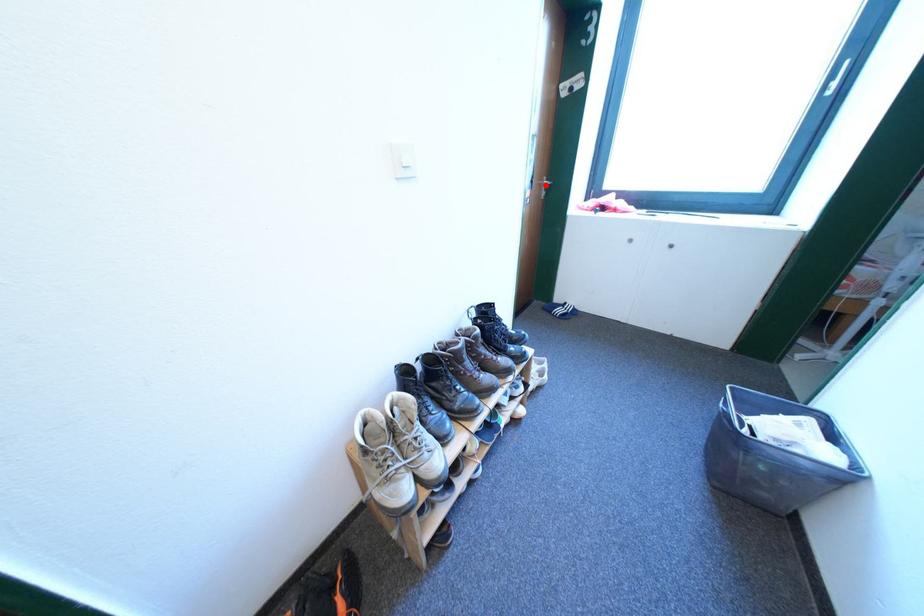
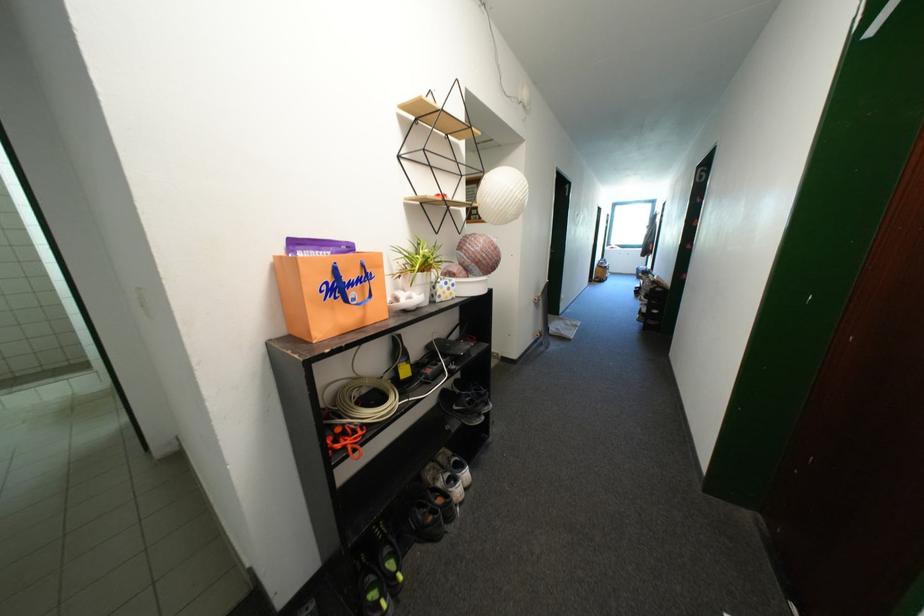
Question: I am providing you with two images of the same scene from different viewpoints. A red point is marked on the first image. At the location where the point appears in image 1, is it still visible in image 2?

Choices:
 (A) Yes
 (B) No

Answer: (B)